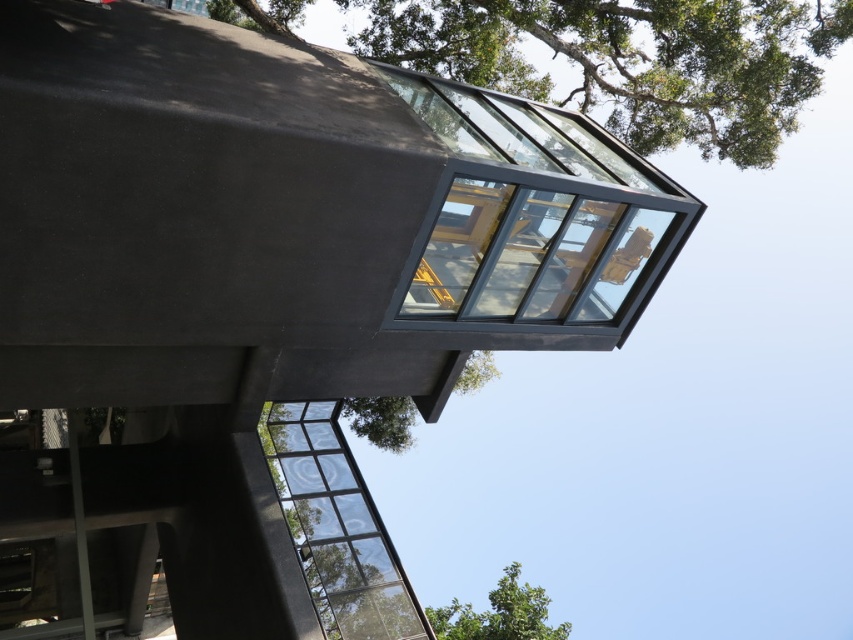
Does green leafy tree at upper center appear under green leafy tree at upper right?

No, green leafy tree at upper center is not below green leafy tree at upper right.

Where is `green leafy tree at upper center`? green leafy tree at upper center is located at coordinates (631, 60).

Between clear glass window at lower left and green leafy tree at upper right, which one has more height?

With more height is clear glass window at lower left.

Does clear glass window at lower left have a larger size compared to green leafy tree at upper right?

Actually, clear glass window at lower left might be smaller than green leafy tree at upper right.

This screenshot has width=853, height=640. What do you see at coordinates (335, 525) in the screenshot?
I see `clear glass window at lower left` at bounding box center [335, 525].

This screenshot has height=640, width=853. Identify the location of clear glass window at lower left. (335, 525).

Is green leafy tree at upper center to the right of clear glass window at lower left from the viewer's perspective?

Correct, you'll find green leafy tree at upper center to the right of clear glass window at lower left.

Who is more distant from viewer, (792, 70) or (325, 548)?

The point (792, 70) is behind.

Where is `green leafy tree at upper center`? Image resolution: width=853 pixels, height=640 pixels. green leafy tree at upper center is located at coordinates (631, 60).